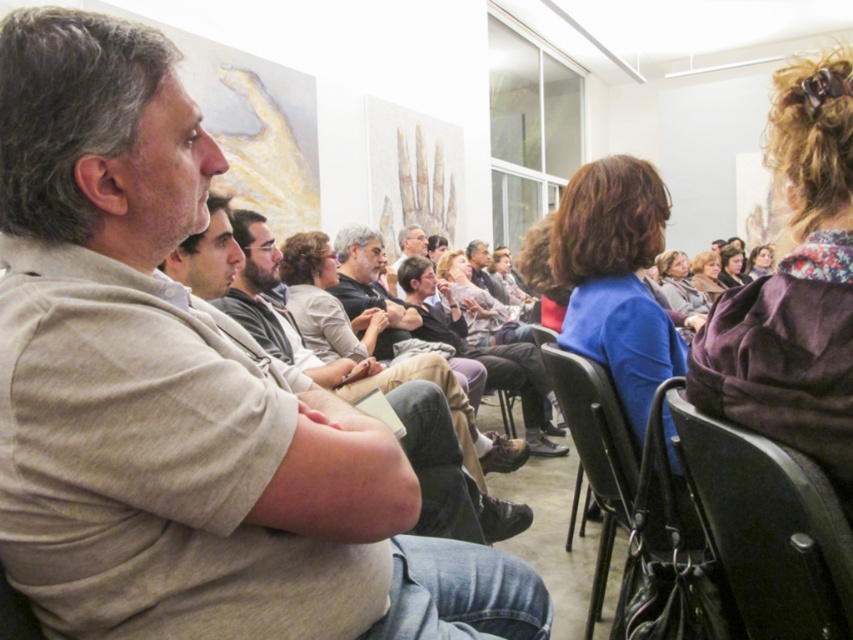
Which of these two, matte blue shirt at center or floral fabric scarf at upper right, stands taller?

matte blue shirt at center

From the picture: Does matte blue shirt at center have a greater height compared to floral fabric scarf at upper right?

Indeed, matte blue shirt at center has a greater height compared to floral fabric scarf at upper right.

Is point (705, 256) positioned before point (762, 252)?

Yes.

Find the location of a particular element. This screenshot has height=640, width=853. matte blue shirt at center is located at coordinates (706, 275).

In the scene shown: Which is more to the left, blue fabric jacket at center or light brown fabric jacket at center?

light brown fabric jacket at center

Describe the element at coordinates (616, 278) in the screenshot. Image resolution: width=853 pixels, height=640 pixels. I see `blue fabric jacket at center` at that location.

The height and width of the screenshot is (640, 853). I want to click on blue fabric jacket at center, so 616,278.

Measure the distance from dark gray sweater at center to gray wool scarf at center.

dark gray sweater at center and gray wool scarf at center are 7.04 feet apart from each other.

Does point (337, 241) come closer to viewer compared to point (679, 269)?

Yes, point (337, 241) is in front of point (679, 269).

Identify the location of dark gray sweater at center. The width and height of the screenshot is (853, 640). (368, 282).